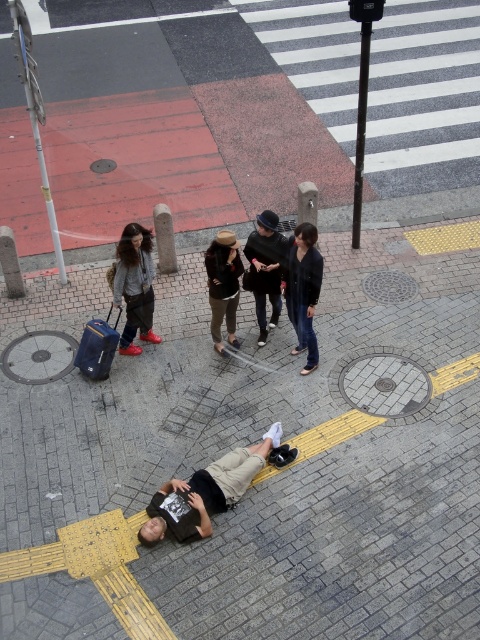
From the picture: You are a delivery person who needs to place both the black matte skateboard at lower center and the black leather jacket at center onto a small delivery cart that can only carry items up to the size of the smaller object. Which object should you prioritize placing first to ensure both fit?

The black leather jacket at center is smaller than the black matte skateboard at lower center. You should place the black leather jacket at center first, then the black matte skateboard at lower center will also fit since it is larger but the cart can accommodate up to the size of the smaller object.

You are a delivery person needing to pick up a black matte skateboard at lower center from the street scene. Considering your vehicle is parked 6 meters away from the scene, can you reach the skateboard without crossing the pedestrian crossing?

The black matte skateboard at lower center is 5.93 meters away from the viewer. Since your vehicle is parked 6 meters away, you can reach the skateboard without crossing the pedestrian crossing as the distance is slightly less than the parking distance.